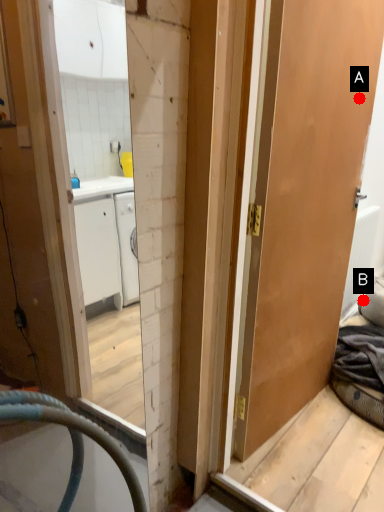
Question: Two points are circled on the image, labeled by A and B beside each circle. Which point is further to the camera?

Choices:
 (A) A is further
 (B) B is further

Answer: (B)